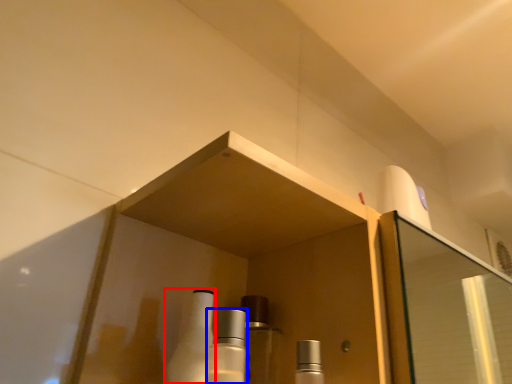
Question: Among these objects, which one is farthest to the camera, bottle (highlighted by a red box) or mouthwash (highlighted by a blue box)?

Choices:
 (A) bottle
 (B) mouthwash

Answer: (A)